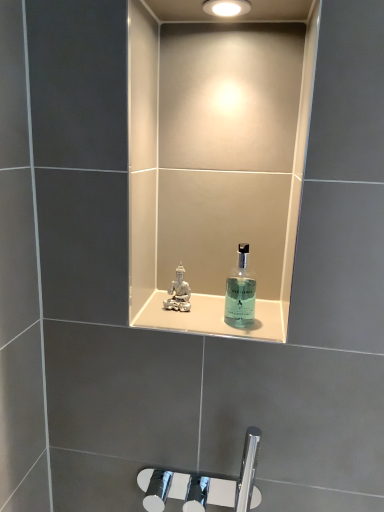
Question: From the image's perspective, would you say transparent glass bottle at center is shown under translucent glass shelf at center?

Choices:
 (A) no
 (B) yes

Answer: (A)

Question: Does transparent glass bottle at center contain translucent glass shelf at center?

Choices:
 (A) no
 (B) yes

Answer: (A)

Question: Can you confirm if transparent glass bottle at center is smaller than translucent glass shelf at center?

Choices:
 (A) no
 (B) yes

Answer: (A)

Question: Is transparent glass bottle at center to the right of translucent glass shelf at center from the viewer's perspective?

Choices:
 (A) no
 (B) yes

Answer: (B)

Question: Can you confirm if transparent glass bottle at center is positioned to the left of translucent glass shelf at center?

Choices:
 (A) no
 (B) yes

Answer: (A)

Question: Is translucent glass shelf at center wider or thinner than transparent glass bottle at center?

Choices:
 (A) wide
 (B) thin

Answer: (A)

Question: In the image, is translucent glass shelf at center positioned in front of or behind transparent glass bottle at center?

Choices:
 (A) front
 (B) behind

Answer: (B)

Question: Is translucent glass shelf at center inside the boundaries of transparent glass bottle at center, or outside?

Choices:
 (A) outside
 (B) inside

Answer: (A)

Question: Looking at the image, does translucent glass shelf at center seem bigger or smaller compared to transparent glass bottle at center?

Choices:
 (A) small
 (B) big

Answer: (A)

Question: Considering the positions of point (268, 334) and point (206, 11), is point (268, 334) closer or farther from the camera than point (206, 11)?

Choices:
 (A) closer
 (B) farther

Answer: (A)

Question: In the image, is translucent glass shelf at center on the left side or the right side of matte white light fixture at upper center?

Choices:
 (A) left
 (B) right

Answer: (A)

Question: Relative to matte white light fixture at upper center, is translucent glass shelf at center in front or behind?

Choices:
 (A) behind
 (B) front

Answer: (A)

Question: Is translucent glass shelf at center taller or shorter than matte white light fixture at upper center?

Choices:
 (A) tall
 (B) short

Answer: (A)

Question: In terms of height, does transparent glass bottle at center look taller or shorter compared to translucent glass shelf at center?

Choices:
 (A) tall
 (B) short

Answer: (A)

Question: Based on their positions, is transparent glass bottle at center located to the left or right of translucent glass shelf at center?

Choices:
 (A) right
 (B) left

Answer: (A)